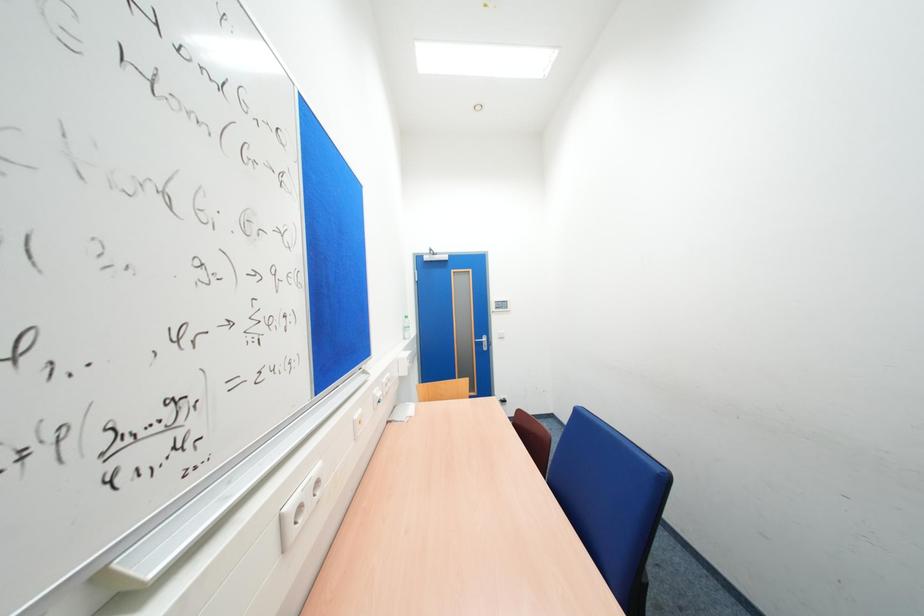
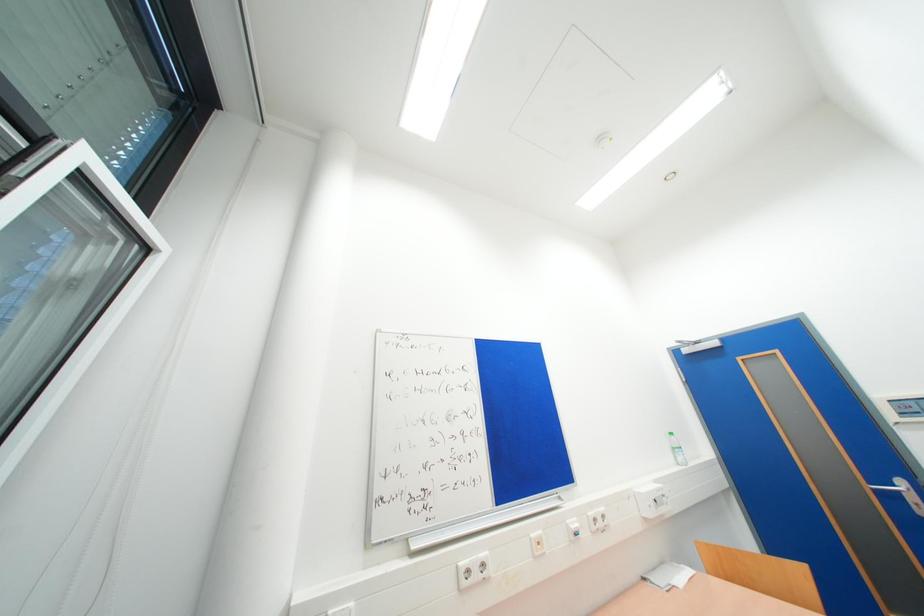
The first image is from the beginning of the video and the second image is from the end. How did the camera likely rotate when shooting the video?

The rotation direction of the camera is left-up.